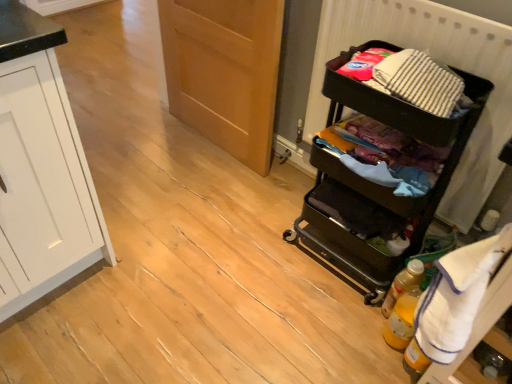
I want to click on vacant area that lies between wooden door at center and translucent yellow bottle at lower right, arranged as the 2th bottle when viewed from the back, so click(x=272, y=210).